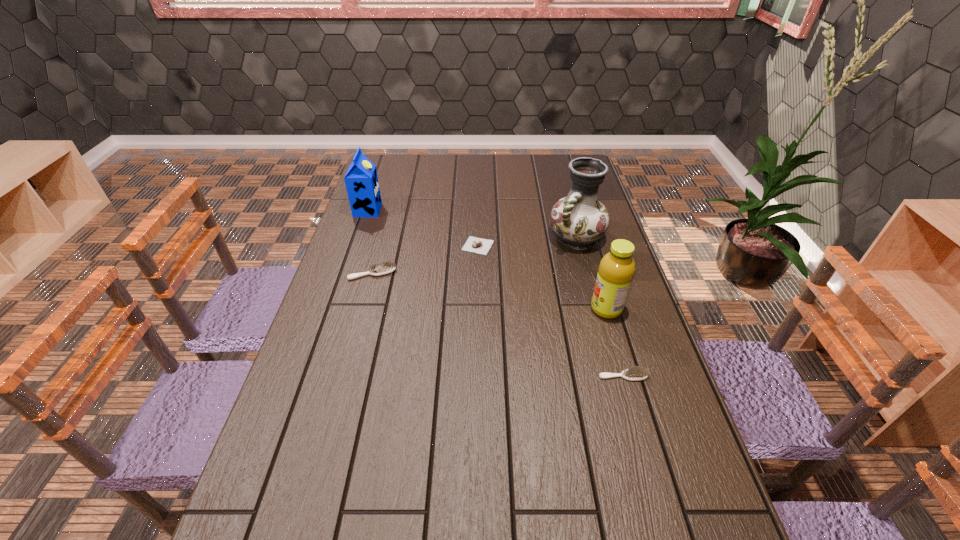
If the aim is uniform spacing by inserting an additional scrubbing_brush among them, please point to a vacant space for this new scrubbing_brush. Please provide its 2D coordinates. Your answer should be formatted as a tuple, i.e. [(x, y)], where the tuple contains the x and y coordinates of a point satisfying the conditions above.

[(483, 319)]